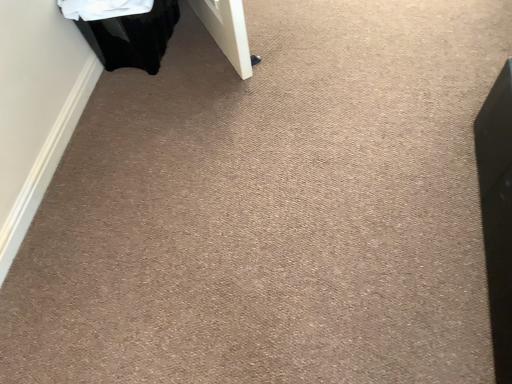
What do you see at coordinates (133, 37) in the screenshot?
I see `black glossy laundry basket at upper left` at bounding box center [133, 37].

Where is `black glossy laundry basket at upper left`? The width and height of the screenshot is (512, 384). black glossy laundry basket at upper left is located at coordinates (133, 37).

Image resolution: width=512 pixels, height=384 pixels. What are the coordinates of `black glossy laundry basket at upper left` in the screenshot? It's located at (133, 37).